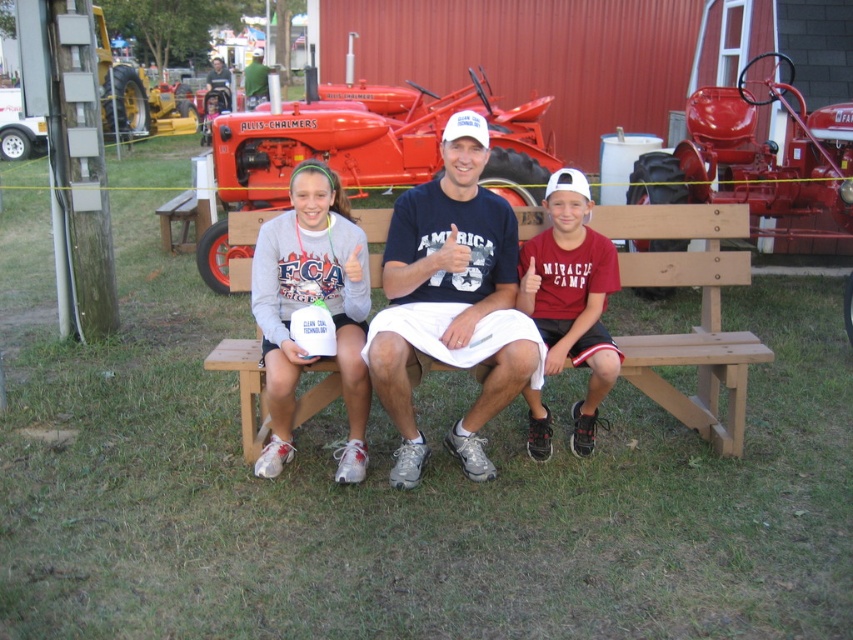
Question: Which point appears closest to the camera in this image?

Choices:
 (A) (216, 67)
 (B) (358, 211)
 (C) (321, 161)
 (D) (259, 80)

Answer: (B)

Question: Is white cotton t-shirt at center to the right of green fabric shirt at upper center from the viewer's perspective?

Choices:
 (A) yes
 (B) no

Answer: (A)

Question: Is wooden bench at center bigger than white matte cup at center?

Choices:
 (A) yes
 (B) no

Answer: (A)

Question: Does white matte cup at center have a larger size compared to green fabric shirt at upper center?

Choices:
 (A) no
 (B) yes

Answer: (A)

Question: Considering the real-world distances, which object is farthest from the matte gray sweatshirt at center?

Choices:
 (A) green fabric shirt at center
 (B) shiny red tractor at center
 (C) red metal tractor at center
 (D) wooden bench at center

Answer: (A)

Question: Which object is closer to the camera taking this photo?

Choices:
 (A) green fabric shirt at upper center
 (B) white matte cup at center
 (C) wooden bench at center
 (D) green fabric shirt at center

Answer: (B)